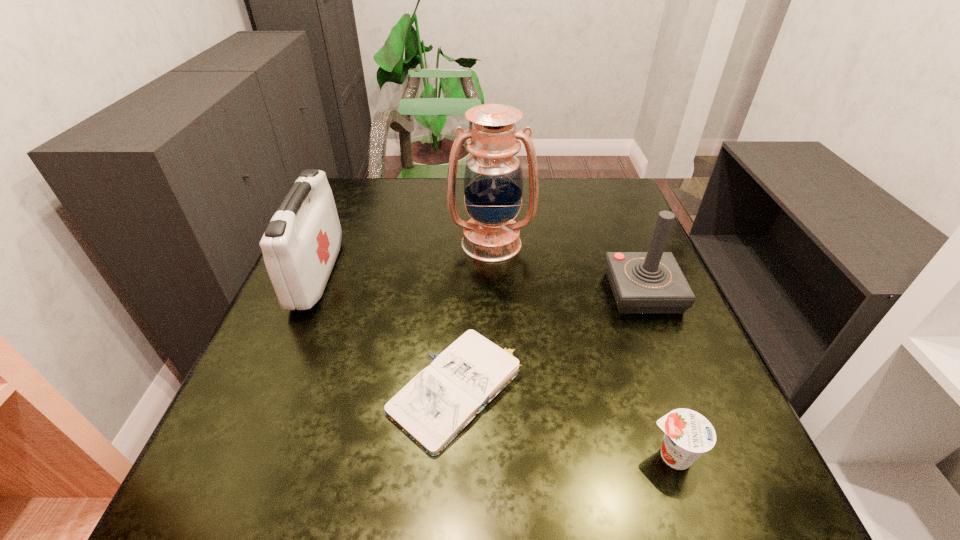
Where is `the closest object to the notebook`? the closest object to the notebook is located at coordinates coord(688,434).

Locate an element on the screen. free space that satisfies the following two spatial constraints: 1. on the front side of the shortest object; 2. on the right side of the leftmost object is located at coordinates (268, 390).

At what (x,y) coordinates should I click in order to perform the action: click on free space that satisfies the following two spatial constraints: 1. on the front side of the shortest object; 2. on the right side of the first-aid kit. Please return your answer as a coordinate pair (x, y). The height and width of the screenshot is (540, 960). Looking at the image, I should click on (268, 390).

Find the location of a particular element. This screenshot has width=960, height=540. free location that satisfies the following two spatial constraints: 1. on the back side of the fourth tallest object; 2. on the front side of the first-aid kit is located at coordinates (611, 274).

Locate an element on the screen. The height and width of the screenshot is (540, 960). free point that satisfies the following two spatial constraints: 1. on the back side of the tallest object; 2. on the right side of the shortest object is located at coordinates (466, 244).

Identify the location of free location that satisfies the following two spatial constraints: 1. on the front side of the first-aid kit; 2. on the right side of the yogurt. (240, 456).

This screenshot has height=540, width=960. I want to click on free spot that satisfies the following two spatial constraints: 1. on the front side of the tallest object; 2. on the front side of the first-aid kit, so click(492, 274).